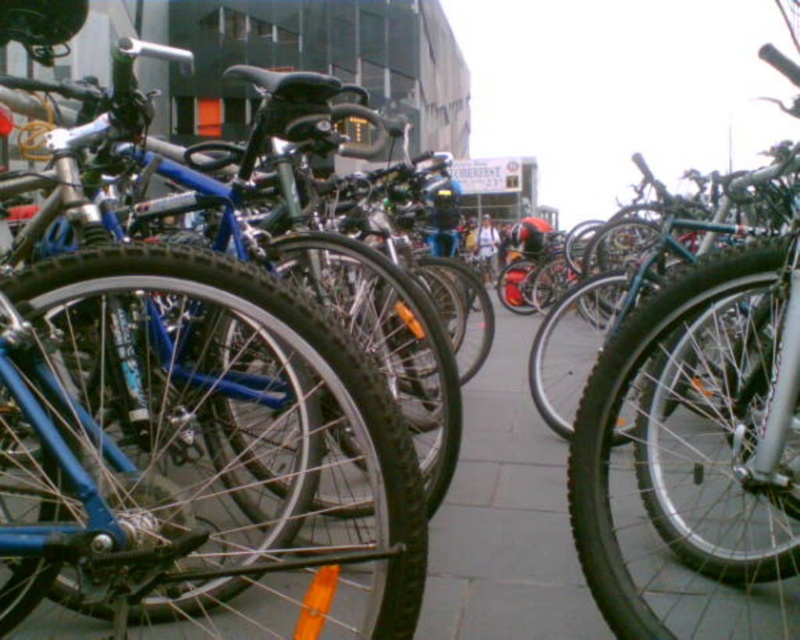
Locate an element on the screen. This screenshot has height=640, width=800. blue matte bicycle at left is located at coordinates (197, 424).

Does point (140, 122) lie behind point (454, 492)?

No, it is not.

Is point (0, 584) behind point (521, 422)?

No.

At what (x,y) coordinates should I click in order to perform the action: click on blue matte bicycle at left. Please return your answer as a coordinate pair (x, y). The width and height of the screenshot is (800, 640). Looking at the image, I should click on (197, 424).